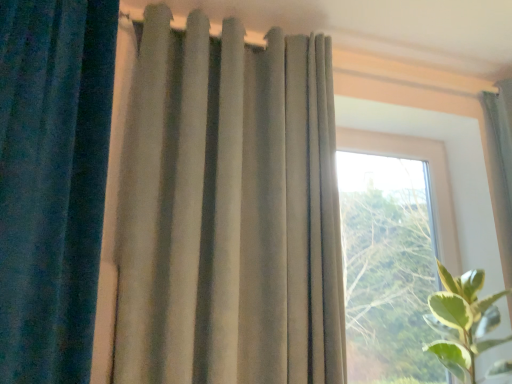
Question: From a real-world perspective, is suede-like beige curtain at center, acting as the second curtain starting from the left, physically below satin beige curtain at upper right, placed as the first curtain when sorted from right to left?

Choices:
 (A) yes
 (B) no

Answer: (A)

Question: From the image's perspective, is suede-like beige curtain at center, acting as the second curtain starting from the left, beneath satin beige curtain at upper right, the 3th curtain in the left-to-right sequence?

Choices:
 (A) no
 (B) yes

Answer: (A)

Question: From the image's perspective, would you say suede-like beige curtain at center, marked as the second curtain in a right-to-left arrangement, is positioned over satin beige curtain at upper right, placed as the first curtain when sorted from right to left?

Choices:
 (A) no
 (B) yes

Answer: (B)

Question: Is suede-like beige curtain at center, acting as the second curtain starting from the left, thinner than satin beige curtain at upper right, the 3th curtain in the left-to-right sequence?

Choices:
 (A) no
 (B) yes

Answer: (B)

Question: Is suede-like beige curtain at center, acting as the second curtain starting from the left, outside satin beige curtain at upper right, placed as the first curtain when sorted from right to left?

Choices:
 (A) no
 (B) yes

Answer: (B)

Question: Is satin beige curtain at upper right, the 3th curtain in the left-to-right sequence, located within suede-like beige curtain at center, marked as the second curtain in a right-to-left arrangement?

Choices:
 (A) no
 (B) yes

Answer: (A)

Question: Is green leafy plant at right with velvet blue curtain at left, which appears as the third curtain when viewed from the right?

Choices:
 (A) yes
 (B) no

Answer: (B)

Question: Can you confirm if green leafy plant at right is positioned to the left of velvet blue curtain at left, which appears as the third curtain when viewed from the right?

Choices:
 (A) yes
 (B) no

Answer: (B)

Question: Is velvet blue curtain at left, which appears as the third curtain when viewed from the right, completely or partially inside green leafy plant at right?

Choices:
 (A) yes
 (B) no

Answer: (B)

Question: Does green leafy plant at right have a greater width compared to velvet blue curtain at left, which appears as the third curtain when viewed from the right?

Choices:
 (A) yes
 (B) no

Answer: (A)

Question: Is green leafy plant at right not near velvet blue curtain at left, which appears as the third curtain when viewed from the right?

Choices:
 (A) yes
 (B) no

Answer: (A)

Question: Is green leafy plant at right positioned beyond the bounds of velvet blue curtain at left, arranged as the first curtain when viewed from the left?

Choices:
 (A) no
 (B) yes

Answer: (B)

Question: Can you confirm if satin beige curtain at upper right, the 3th curtain in the left-to-right sequence, is smaller than green leafy plant at right?

Choices:
 (A) yes
 (B) no

Answer: (A)